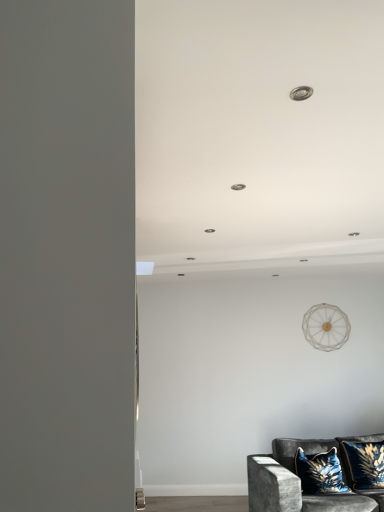
Question: From a real-world perspective, is velvet blue pillow at lower right, which appears as the 2th pillow when viewed from the left, positioned over velvet dark gray couch at lower right based on gravity?

Choices:
 (A) no
 (B) yes

Answer: (B)

Question: Is velvet blue pillow at lower right, placed as the first pillow when sorted from right to left, to the left of velvet dark gray couch at lower right from the viewer's perspective?

Choices:
 (A) yes
 (B) no

Answer: (B)

Question: Is velvet blue pillow at lower right, placed as the first pillow when sorted from right to left, thinner than velvet dark gray couch at lower right?

Choices:
 (A) yes
 (B) no

Answer: (A)

Question: From the image's perspective, is velvet blue pillow at lower right, placed as the first pillow when sorted from right to left, on top of velvet dark gray couch at lower right?

Choices:
 (A) yes
 (B) no

Answer: (A)

Question: Is velvet blue pillow at lower right, placed as the first pillow when sorted from right to left, next to velvet dark gray couch at lower right and touching it?

Choices:
 (A) yes
 (B) no

Answer: (B)

Question: Is velvet blue pillow at lower right, placed as the first pillow when sorted from right to left, at the right side of velvet dark gray couch at lower right?

Choices:
 (A) yes
 (B) no

Answer: (A)

Question: Is velvet blue pillow at lower right, which appears as the 2th pillow when viewed from the left, far from velvet blue pillow at lower right, the 2th pillow positioned from the right?

Choices:
 (A) no
 (B) yes

Answer: (A)

Question: From a real-world perspective, is velvet blue pillow at lower right, which appears as the 2th pillow when viewed from the left, beneath velvet blue pillow at lower right, marked as the first pillow in a left-to-right arrangement?

Choices:
 (A) yes
 (B) no

Answer: (B)

Question: Is velvet blue pillow at lower right, which appears as the 2th pillow when viewed from the left, wider than velvet blue pillow at lower right, marked as the first pillow in a left-to-right arrangement?

Choices:
 (A) no
 (B) yes

Answer: (A)

Question: From the image's perspective, is velvet blue pillow at lower right, which appears as the 2th pillow when viewed from the left, located beneath velvet blue pillow at lower right, the 2th pillow positioned from the right?

Choices:
 (A) yes
 (B) no

Answer: (B)

Question: Is velvet blue pillow at lower right, which appears as the 2th pillow when viewed from the left, positioned beyond the bounds of velvet blue pillow at lower right, marked as the first pillow in a left-to-right arrangement?

Choices:
 (A) no
 (B) yes

Answer: (B)

Question: Is velvet blue pillow at lower right, marked as the first pillow in a left-to-right arrangement, at the back of velvet blue pillow at lower right, which appears as the 2th pillow when viewed from the left?

Choices:
 (A) yes
 (B) no

Answer: (B)

Question: Considering the relative sizes of velvet blue pillow at lower right, marked as the first pillow in a left-to-right arrangement, and velvet dark gray couch at lower right in the image provided, is velvet blue pillow at lower right, marked as the first pillow in a left-to-right arrangement, shorter than velvet dark gray couch at lower right?

Choices:
 (A) no
 (B) yes

Answer: (B)